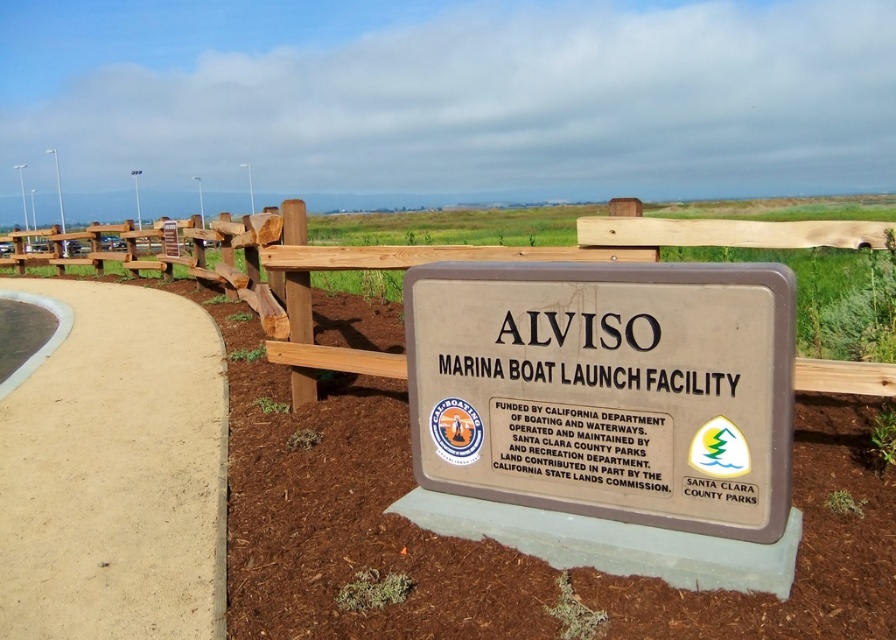
From the picture: Can you confirm if brown polished wood sign at center is thinner than light tan concrete at lower left?

Incorrect, brown polished wood sign at center's width is not less than light tan concrete at lower left's.

Does brown polished wood sign at center have a larger size compared to light tan concrete at lower left?

Indeed, brown polished wood sign at center has a larger size compared to light tan concrete at lower left.

Between point (774, 458) and point (197, 627), which one is positioned in front?

Point (774, 458)

At what (x,y) coordinates should I click in order to perform the action: click on brown polished wood sign at center. Please return your answer as a coordinate pair (x, y). Looking at the image, I should click on [606, 388].

Measure the distance from light tan concrete at lower left to brown wooden sign at center.

light tan concrete at lower left and brown wooden sign at center are 5.27 meters apart from each other.

Is light tan concrete at lower left thinner than brown wooden sign at center?

Correct, light tan concrete at lower left's width is less than brown wooden sign at center's.

Does point (65, 346) come behind point (179, 300)?

That is False.

The height and width of the screenshot is (640, 896). What are the coordinates of `light tan concrete at lower left` in the screenshot? It's located at (115, 472).

The width and height of the screenshot is (896, 640). What do you see at coordinates (606, 388) in the screenshot?
I see `brown polished wood sign at center` at bounding box center [606, 388].

Can you confirm if brown polished wood sign at center is smaller than brown wooden sign at center?

Correct, brown polished wood sign at center occupies less space than brown wooden sign at center.

Image resolution: width=896 pixels, height=640 pixels. I want to click on brown polished wood sign at center, so click(x=606, y=388).